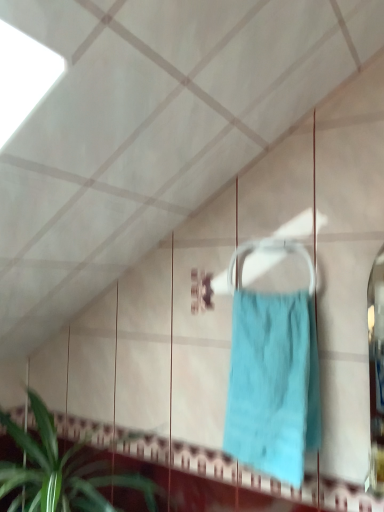
Question: Is green leafy plant at lower left thinner than teal fabric towel at center?

Choices:
 (A) yes
 (B) no

Answer: (B)

Question: Is green leafy plant at lower left aimed at teal fabric towel at center?

Choices:
 (A) yes
 (B) no

Answer: (B)

Question: Is green leafy plant at lower left taller than teal fabric towel at center?

Choices:
 (A) no
 (B) yes

Answer: (A)

Question: Is green leafy plant at lower left not inside teal fabric towel at center?

Choices:
 (A) yes
 (B) no

Answer: (A)

Question: Is the position of green leafy plant at lower left less distant than that of teal fabric towel at center?

Choices:
 (A) no
 (B) yes

Answer: (B)

Question: Does green leafy plant at lower left have a greater width compared to teal fabric towel at center?

Choices:
 (A) yes
 (B) no

Answer: (A)

Question: Is teal fabric towel at center positioned beyond the bounds of green leafy plant at lower left?

Choices:
 (A) yes
 (B) no

Answer: (A)

Question: From a real-world perspective, is teal fabric towel at center physically above green leafy plant at lower left?

Choices:
 (A) yes
 (B) no

Answer: (A)

Question: Would you say teal fabric towel at center is a long distance from green leafy plant at lower left?

Choices:
 (A) yes
 (B) no

Answer: (B)

Question: From the image's perspective, is teal fabric towel at center below green leafy plant at lower left?

Choices:
 (A) no
 (B) yes

Answer: (A)

Question: Is green leafy plant at lower left at the back of teal fabric towel at center?

Choices:
 (A) no
 (B) yes

Answer: (A)

Question: Can you confirm if teal fabric towel at center is taller than green leafy plant at lower left?

Choices:
 (A) no
 (B) yes

Answer: (B)

Question: Is green leafy plant at lower left in front of or behind teal fabric towel at center in the image?

Choices:
 (A) front
 (B) behind

Answer: (A)